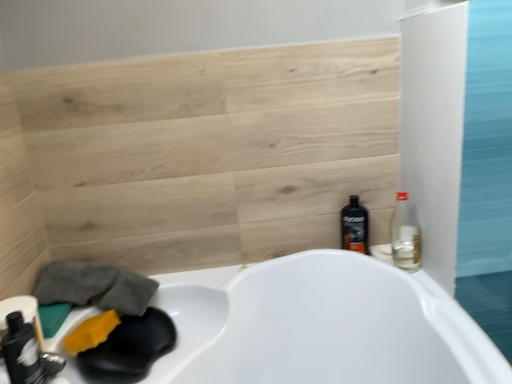
Question: Can you confirm if black plastic bottle at right, which ranks as the 2th bottle in right-to-left order, is wider than matte black bottle at lower left, which is the third bottle in back-to-front order?

Choices:
 (A) no
 (B) yes

Answer: (A)

Question: From a real-world perspective, is black plastic bottle at right, which ranks as the 2th bottle in right-to-left order, beneath matte black bottle at lower left, which is the 3th bottle from right to left?

Choices:
 (A) yes
 (B) no

Answer: (A)

Question: Can you confirm if black plastic bottle at right, marked as the third bottle in a front-to-back arrangement, is bigger than matte black bottle at lower left, which is counted as the first bottle, starting from the front?

Choices:
 (A) yes
 (B) no

Answer: (B)

Question: Can you confirm if black plastic bottle at right, placed as the second bottle when sorted from left to right, is shorter than matte black bottle at lower left, which is the 3th bottle from right to left?

Choices:
 (A) no
 (B) yes

Answer: (A)

Question: Does black plastic bottle at right, acting as the 1th bottle starting from the back, have a lesser width compared to matte black bottle at lower left, marked as the first bottle in a left-to-right arrangement?

Choices:
 (A) yes
 (B) no

Answer: (A)

Question: Is black plastic bottle at right, acting as the 1th bottle starting from the back, positioned far away from matte black bottle at lower left, which is the third bottle in back-to-front order?

Choices:
 (A) yes
 (B) no

Answer: (B)

Question: Can you confirm if black plastic bottle at right, marked as the third bottle in a front-to-back arrangement, is positioned to the left of yellow sponge at lower left?

Choices:
 (A) yes
 (B) no

Answer: (B)

Question: Can you confirm if black plastic bottle at right, marked as the third bottle in a front-to-back arrangement, is taller than yellow sponge at lower left?

Choices:
 (A) no
 (B) yes

Answer: (B)

Question: Is black plastic bottle at right, which ranks as the 2th bottle in right-to-left order, turned away from yellow sponge at lower left?

Choices:
 (A) no
 (B) yes

Answer: (A)

Question: Is black plastic bottle at right, placed as the second bottle when sorted from left to right, next to yellow sponge at lower left?

Choices:
 (A) no
 (B) yes

Answer: (A)

Question: Can you confirm if black plastic bottle at right, marked as the third bottle in a front-to-back arrangement, is smaller than yellow sponge at lower left?

Choices:
 (A) yes
 (B) no

Answer: (B)

Question: Is black plastic bottle at right, marked as the third bottle in a front-to-back arrangement, bigger than yellow sponge at lower left?

Choices:
 (A) yes
 (B) no

Answer: (A)

Question: Can you confirm if yellow sponge at lower left is wider than matte black bottle at lower left, which is counted as the first bottle, starting from the front?

Choices:
 (A) yes
 (B) no

Answer: (A)